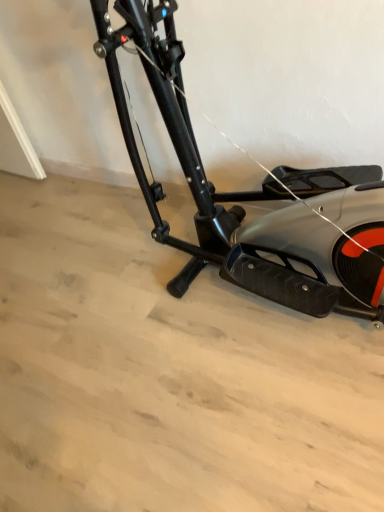
Find the location of `vacant space that is to the left of metallic silver elliptical trainer at center`. vacant space that is to the left of metallic silver elliptical trainer at center is located at coordinates (79, 320).